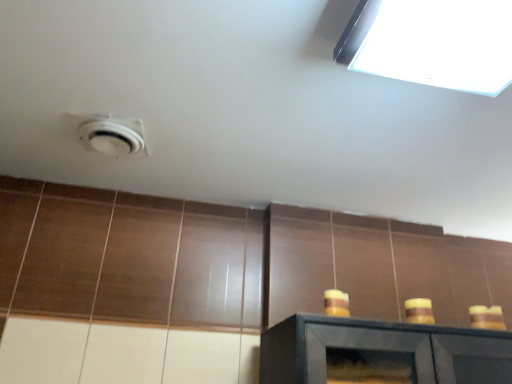
Find the location of a particular element. The image size is (512, 384). white glossy light at upper right is located at coordinates (432, 43).

The width and height of the screenshot is (512, 384). What do you see at coordinates (432, 43) in the screenshot?
I see `white glossy light at upper right` at bounding box center [432, 43].

Locate an element on the screen. This screenshot has height=384, width=512. white glossy light at upper right is located at coordinates (432, 43).